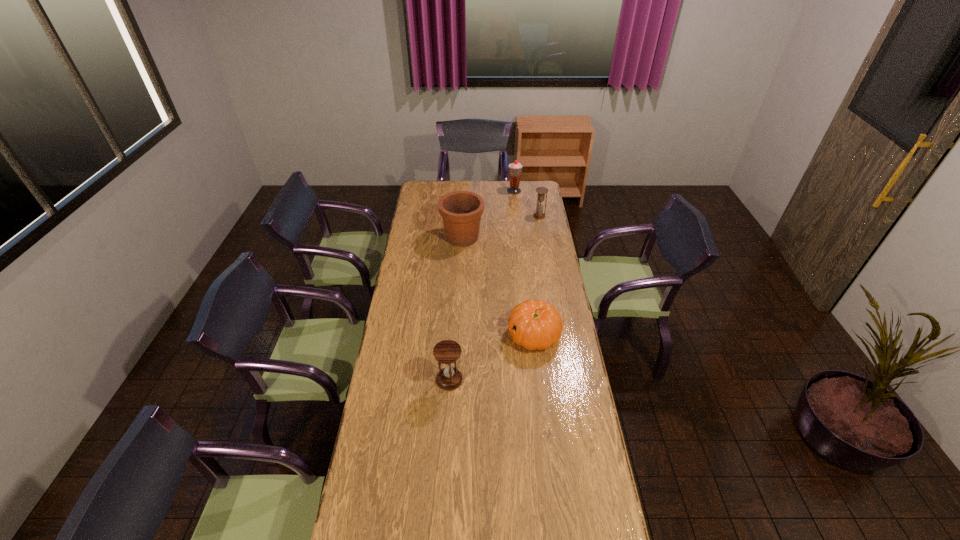
Identify which object is the second closest to the nearer hourglass. Please provide its 2D coordinates. Your answer should be formatted as a tuple, i.e. [(x, y)], where the tuple contains the x and y coordinates of a point satisfying the conditions above.

[(461, 211)]

Find the location of a particular element. This screenshot has width=960, height=540. vacant space that satisfies the following two spatial constraints: 1. on the front side of the fourth nearest object; 2. on the carved face of the pumpkin is located at coordinates (560, 335).